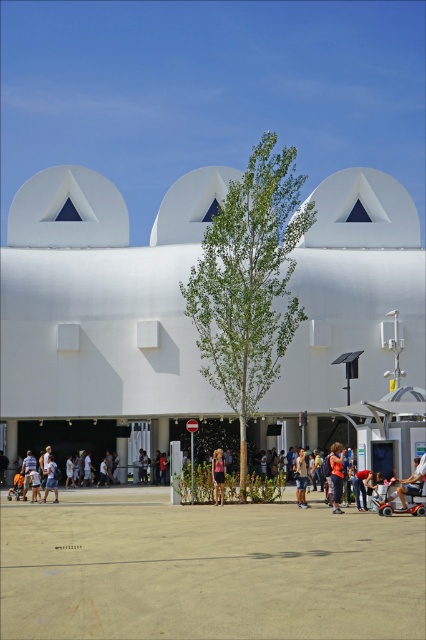
Question: Is orange fabric shirt at center in front of pink fabric dress at center?

Choices:
 (A) no
 (B) yes

Answer: (B)

Question: Considering the relative positions of green leafy tree at center and pink fabric dress at center in the image provided, where is green leafy tree at center located with respect to pink fabric dress at center?

Choices:
 (A) left
 (B) right

Answer: (B)

Question: Which of the following is the farthest from the observer?

Choices:
 (A) light blue denim shorts at lower left
 (B) green leafy tree at center
 (C) pink fabric dress at center
 (D) white smooth building at center

Answer: (D)

Question: Which point is closer to the camera taking this photo?

Choices:
 (A) (340, 509)
 (B) (218, 468)
 (C) (48, 472)
 (D) (291, 404)

Answer: (A)

Question: Among these points, which one is farthest from the camera?

Choices:
 (A) (305, 461)
 (B) (239, 326)
 (C) (340, 492)
 (D) (54, 500)

Answer: (D)

Question: Considering the relative positions of orange fabric shirt at center and denim shorts at center in the image provided, where is orange fabric shirt at center located with respect to denim shorts at center?

Choices:
 (A) right
 (B) left

Answer: (A)